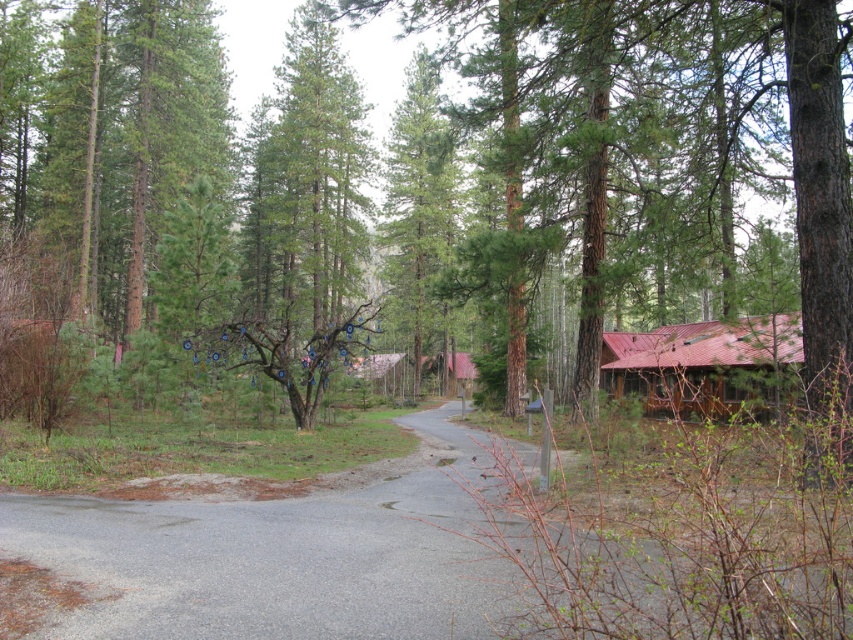
Question: Is the position of green matte tree at center less distant than that of metallic red cabin at right?

Choices:
 (A) yes
 (B) no

Answer: (A)

Question: Among these points, which one is farthest from the camera?

Choices:
 (A) click(709, 403)
 (B) click(97, 193)

Answer: (B)

Question: Is green matte tree at center smaller than metallic red cabin at right?

Choices:
 (A) no
 (B) yes

Answer: (A)

Question: Where is green matte tree at center located in relation to metallic red cabin at right in the image?

Choices:
 (A) below
 (B) above

Answer: (B)

Question: Which object appears closest to the camera in this image?

Choices:
 (A) green matte tree at center
 (B) metallic red cabin at right

Answer: (A)